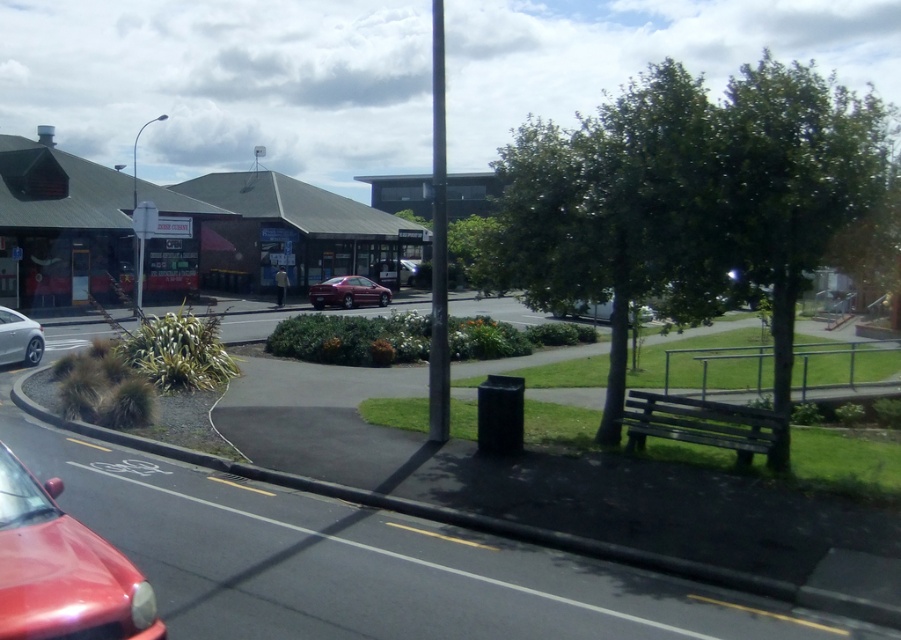
Question: Which point appears farthest from the camera in this image?

Choices:
 (A) (38, 552)
 (B) (384, 275)
 (C) (41, 328)
 (D) (369, 291)

Answer: (B)

Question: Does shiny red car at lower left appear on the left side of silver metallic sedan at left?

Choices:
 (A) no
 (B) yes

Answer: (A)

Question: Which point is farther to the camera?

Choices:
 (A) matte red car at center
 (B) silver metallic sedan at left
 (C) shiny red car at center

Answer: (A)

Question: Which of the following is the farthest from the observer?

Choices:
 (A) silver metallic sedan at left
 (B) shiny red car at lower left
 (C) shiny red car at center
 (D) matte red car at center

Answer: (D)

Question: Can you confirm if shiny red car at lower left is positioned to the right of shiny red car at center?

Choices:
 (A) no
 (B) yes

Answer: (B)

Question: Is shiny red car at lower left bigger than matte red car at center?

Choices:
 (A) yes
 (B) no

Answer: (B)